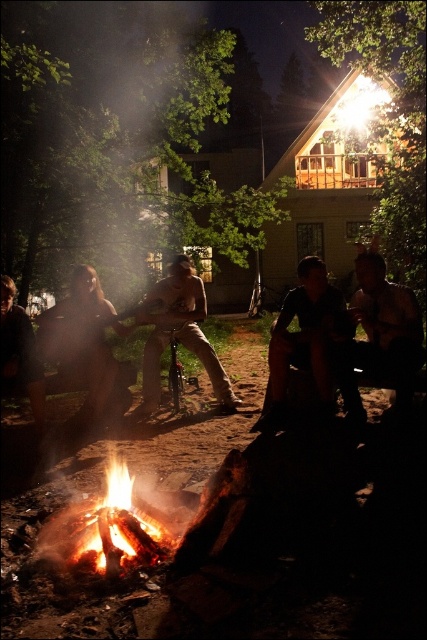
Question: Which point is closer to the camera taking this photo?

Choices:
 (A) (47, 312)
 (B) (371, 328)
 (C) (81, 531)
 (D) (160, 282)

Answer: (C)

Question: Is flaming wood fire at center closer to the viewer compared to blonde hair at center?

Choices:
 (A) yes
 (B) no

Answer: (A)

Question: Is brown leather jacket at center further to camera compared to dark brown leather jacket at lower left?

Choices:
 (A) no
 (B) yes

Answer: (A)

Question: Which of these objects is positioned farthest from the brown leather jacket at center?

Choices:
 (A) dark fabric pants at lower right
 (B) blonde hair at center

Answer: (B)

Question: Is dark fabric pants at lower right smaller than tan leather pants at center?

Choices:
 (A) yes
 (B) no

Answer: (B)

Question: Which point is closer to the camera?

Choices:
 (A) dark brown leather jacket at lower left
 (B) dark fabric pants at lower right

Answer: (B)